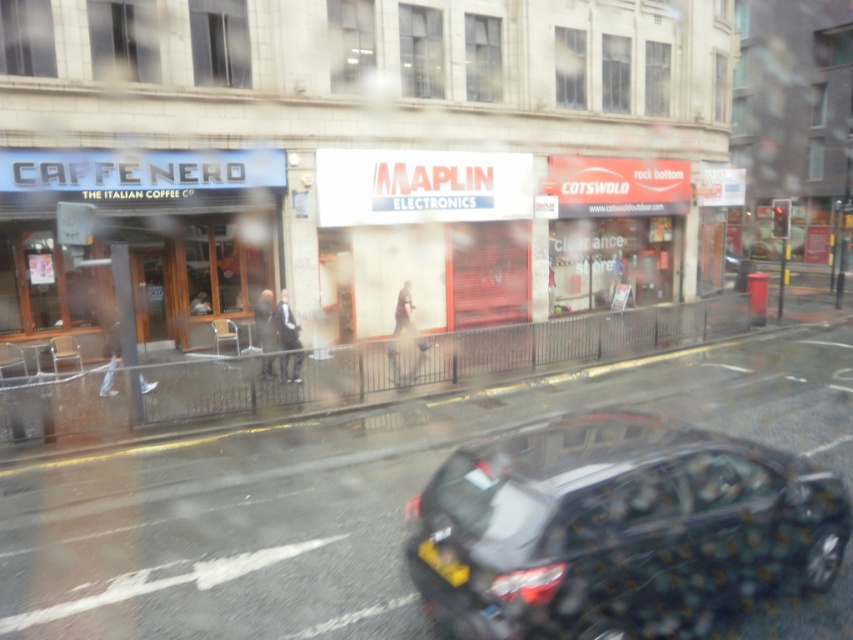
Question: Estimate the real-world distances between objects in this image. Which object is closer to the matte black storefront at left?

Choices:
 (A) yellow matte license plate at lower center
 (B) metallic gray hatchback at lower center

Answer: (A)

Question: Is metallic gray hatchback at lower center below yellow matte license plate at lower center?

Choices:
 (A) yes
 (B) no

Answer: (B)

Question: Does matte black storefront at left have a greater width compared to yellow matte license plate at lower center?

Choices:
 (A) no
 (B) yes

Answer: (A)

Question: Observing the image, what is the correct spatial positioning of matte black storefront at left in reference to yellow matte license plate at lower center?

Choices:
 (A) below
 (B) above

Answer: (B)

Question: Which object is farther from the camera taking this photo?

Choices:
 (A) matte black storefront at left
 (B) yellow matte license plate at lower center

Answer: (A)

Question: Which point is closer to the camera?

Choices:
 (A) (543, 435)
 (B) (209, 195)

Answer: (A)